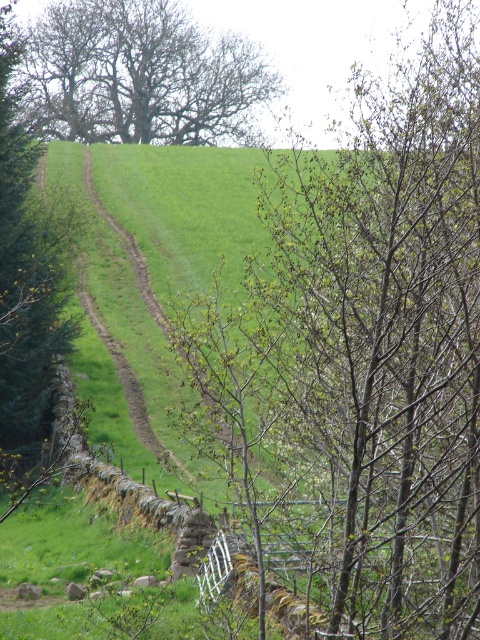
Based on the photo, how distant is green leafy tree at center from green leafy tree at upper left?

green leafy tree at center is 7.84 meters from green leafy tree at upper left.

Is green leafy tree at center shorter than green leafy tree at upper left?

Yes, green leafy tree at center is shorter than green leafy tree at upper left.

The height and width of the screenshot is (640, 480). What are the coordinates of `green leafy tree at center` in the screenshot? It's located at (360, 356).

Looking at this image, can you confirm if green leafy tree at center is positioned above brown textured tree at upper left?

No.

Between point (405, 220) and point (90, 108), which one is positioned in front?

Point (405, 220) is more forward.

You are a GUI agent. You are given a task and a screenshot of the screen. Output one action in this format:
    pyautogui.click(x=<x>, y=<y>)
    Task: Click on the green leafy tree at center
    
    Given the screenshot: What is the action you would take?
    pyautogui.click(x=360, y=356)

Is the position of brown textured tree at upper left less distant than that of green leafy tree at upper left?

No, it is behind green leafy tree at upper left.

Is brown textured tree at upper left bigger than green leafy tree at upper left?

No, brown textured tree at upper left is not bigger than green leafy tree at upper left.

Measure the distance between point (162, 13) and camera.

They are 100.70 meters apart.

Identify the location of brown textured tree at upper left. Image resolution: width=480 pixels, height=640 pixels. (140, 76).